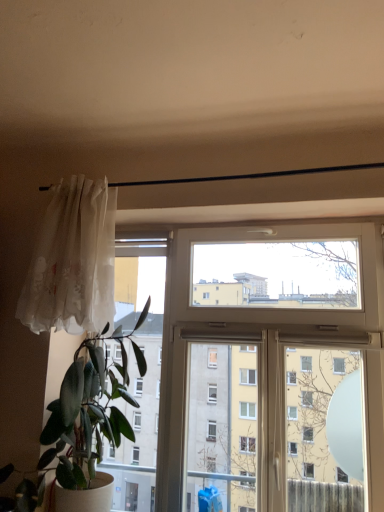
The image size is (384, 512). Identify the location of green matte plant at left. click(88, 411).

Find the location of a particular element. The height and width of the screenshot is (512, 384). green matte plant at left is located at coordinates (88, 411).

Where is `window on the right of translucent white curtain at left`? window on the right of translucent white curtain at left is located at coordinates (268, 353).

Considering the sizes of translucent white curtain at left and white plastic window at center in the image, is translucent white curtain at left taller or shorter than white plastic window at center?

Considering their sizes, translucent white curtain at left has less height than white plastic window at center.

Is translucent white curtain at left to the left or to the right of white plastic window at center in the image?

Clearly, translucent white curtain at left is on the left of white plastic window at center in the image.

Between point (75, 278) and point (158, 456), which one is positioned behind?

The point (158, 456) is farther from the camera.

From the picture: Is translucent white curtain at left far away from green matte plant at left?

They are positioned close to each other.

At what (x,y) coordinates should I click in order to perform the action: click on curtain lying above the green matte plant at left (from the image's perspective). Please return your answer as a coordinate pair (x, y). Looking at the image, I should click on (73, 261).

Considering the relative positions of translucent white curtain at left and green matte plant at left in the image provided, is translucent white curtain at left to the right of green matte plant at left from the viewer's perspective?

In fact, translucent white curtain at left is to the left of green matte plant at left.

How different are the orientations of translucent white curtain at left and green matte plant at left in degrees?

0.000213 degrees.

Considering the sizes of objects green matte plant at left and translucent white curtain at left in the image provided, who is smaller, green matte plant at left or translucent white curtain at left?

Smaller between the two is translucent white curtain at left.

Between green matte plant at left and translucent white curtain at left, which one appears on the right side from the viewer's perspective?

green matte plant at left is more to the right.

Considering the sizes of white plastic window at center and translucent white curtain at left in the image, is white plastic window at center taller or shorter than translucent white curtain at left?

Considering their sizes, white plastic window at center has more height than translucent white curtain at left.

Which object is more forward, white plastic window at center or translucent white curtain at left?

white plastic window at center is closer to the camera.

From a real-world perspective, does white plastic window at center sit lower than translucent white curtain at left?

Yes, from a real-world perspective, white plastic window at center is below translucent white curtain at left.

Who is bigger, white plastic window at center or translucent white curtain at left?

white plastic window at center.

How many degrees apart are the facing directions of white plastic window at center and green matte plant at left?

They differ by 1.25 degrees in their facing directions.

Is green matte plant at left located within white plastic window at center?

No, green matte plant at left is not a part of white plastic window at center.

Is white plastic window at center smaller than green matte plant at left?

Yes.

Between green matte plant at left and white plastic window at center, which one is positioned behind?

white plastic window at center is more distant.

Would you consider green matte plant at left to be distant from white plastic window at center?

No, green matte plant at left is not far from white plastic window at center.

Is green matte plant at left oriented towards white plastic window at center?

No, green matte plant at left is not oriented towards white plastic window at center.

Considering the relative sizes of green matte plant at left and white plastic window at center in the image provided, is green matte plant at left thinner than white plastic window at center?

In fact, green matte plant at left might be wider than white plastic window at center.

Locate an element on the screen. Image resolution: width=384 pixels, height=512 pixels. curtain behind the white plastic window at center is located at coordinates (73, 261).

Identify the location of houseplant lying below the translucent white curtain at left (from the image's perspective). This screenshot has height=512, width=384. (88, 411).

From the image, which object appears to be nearer to green matte plant at left, white plastic window at center or translucent white curtain at left?

The object closer to green matte plant at left is translucent white curtain at left.

From the image, which object appears to be nearer to white plastic window at center, green matte plant at left or translucent white curtain at left?

green matte plant at left lies closer to white plastic window at center than the other object.

Considering their positions, is translucent white curtain at left positioned further to green matte plant at left than white plastic window at center?

Among the two, white plastic window at center is located further to green matte plant at left.

When comparing their distances from translucent white curtain at left, does green matte plant at left or white plastic window at center seem further?

Based on the image, white plastic window at center appears to be further to translucent white curtain at left.

Which object lies nearer to the anchor point white plastic window at center, translucent white curtain at left or green matte plant at left?

The object closer to white plastic window at center is green matte plant at left.

Considering their positions, is white plastic window at center positioned closer to translucent white curtain at left than green matte plant at left?

The object closer to translucent white curtain at left is green matte plant at left.

Where is `houseplant between translucent white curtain at left and white plastic window at center in the horizontal direction`? The height and width of the screenshot is (512, 384). houseplant between translucent white curtain at left and white plastic window at center in the horizontal direction is located at coordinates (88, 411).